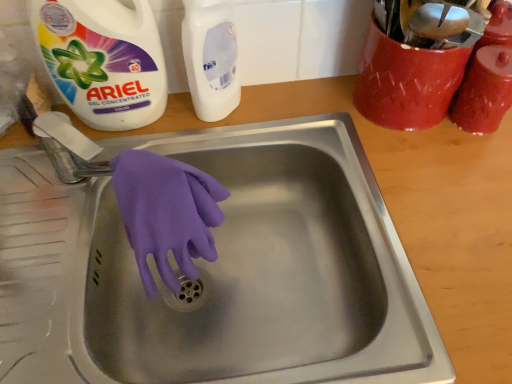
You are a GUI agent. You are given a task and a screenshot of the screen. Output one action in this format:
    pyautogui.click(x=<x>, y=<y>)
    Task: Click on the vacant area situated to the left side of matte red jar at upper right, which is the 1th cleaning product from right to left
    
    Given the screenshot: What is the action you would take?
    pyautogui.click(x=353, y=134)